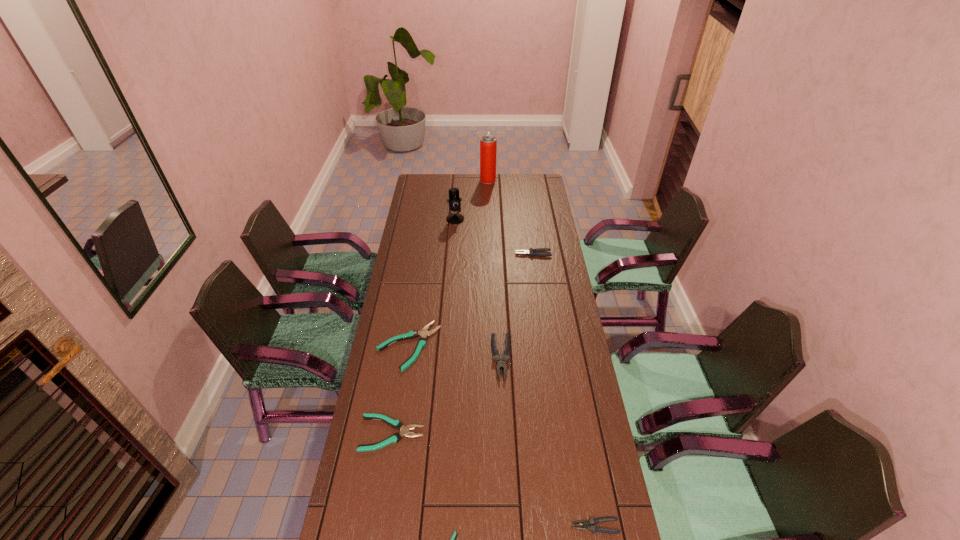
This screenshot has height=540, width=960. In order to click on the second shortest pliers in this screenshot , I will do `click(397, 424)`.

Locate an element on the screen. the second shortest object is located at coordinates (397, 424).

Where is `vacant space situated on the front of the tallest object`? The height and width of the screenshot is (540, 960). vacant space situated on the front of the tallest object is located at coordinates (489, 217).

I want to click on vacant area situated 0.060m on the stand of the black microphone, so click(x=454, y=231).

Identify the location of free space located 0.180m at the gripping part of the tallest pliers. (504, 430).

Identify the location of free spot located at the gripping part of the farthest pliers. The image size is (960, 540). (469, 254).

Find the location of a particular element. The height and width of the screenshot is (540, 960). vacant area situated 0.330m at the gripping part of the farthest pliers is located at coordinates (444, 254).

You are a GUI agent. You are given a task and a screenshot of the screen. Output one action in this format:
    pyautogui.click(x=<x>, y=<y>)
    Task: Click on the free location located at the gripping part of the farthest pliers
    The image size is (960, 540).
    Given the screenshot: What is the action you would take?
    pyautogui.click(x=481, y=254)

The image size is (960, 540). What are the coordinates of `vacant area located 0.260m on the back of the farthest teal pliers` in the screenshot? It's located at (419, 278).

The height and width of the screenshot is (540, 960). What are the coordinates of `blank space located at the gripping part of the nearest gray pliers` in the screenshot? It's located at (545, 526).